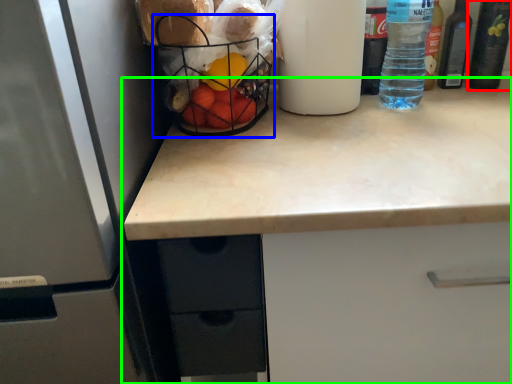
Question: Based on their relative distances, which object is nearer to bottle (highlighted by a red box)? Choose from basket (highlighted by a blue box) and countertop (highlighted by a green box).

Choices:
 (A) basket
 (B) countertop

Answer: (B)